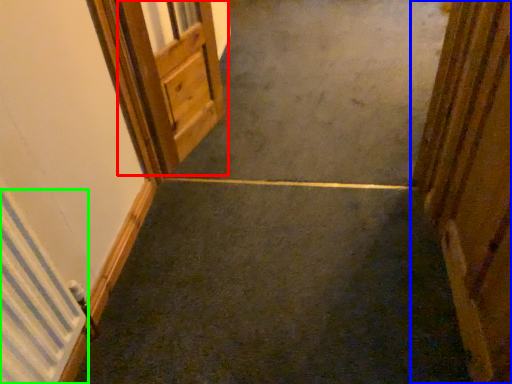
Question: Which object is positioned closest to door (highlighted by a red box)? Select from door (highlighted by a blue box) and radiator (highlighted by a green box).

Choices:
 (A) door
 (B) radiator

Answer: (B)